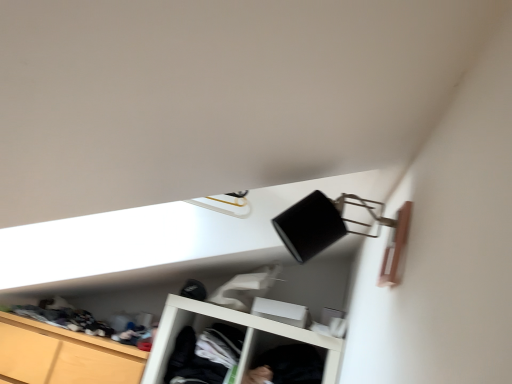
The height and width of the screenshot is (384, 512). What do you see at coordinates (293, 364) in the screenshot?
I see `black cotton shirt at lower center, the first clothing when ordered from right to left` at bounding box center [293, 364].

The height and width of the screenshot is (384, 512). Identify the location of black cotton shirt at lower center, the first clothing when ordered from right to left. (293, 364).

The width and height of the screenshot is (512, 384). What do you see at coordinates (205, 354) in the screenshot?
I see `dark gray fabric at center, the first clothing when ordered from left to right` at bounding box center [205, 354].

You are a GUI agent. You are given a task and a screenshot of the screen. Output one action in this format:
    pyautogui.click(x=<x>, y=<y>)
    Task: Click on the dark gray fabric at center, the second clothing when ordered from right to left
    This screenshot has height=384, width=512.
    Given the screenshot: What is the action you would take?
    pyautogui.click(x=205, y=354)

Locate an element on the screen. The height and width of the screenshot is (384, 512). black cotton shirt at lower center, the second clothing viewed from the left is located at coordinates (293, 364).

This screenshot has width=512, height=384. Find the location of `cabinetry lying on the left of black cotton shirt at lower center, the first clothing when ordered from right to left`. cabinetry lying on the left of black cotton shirt at lower center, the first clothing when ordered from right to left is located at coordinates (63, 355).

Which object is further away from the camera taking this photo, wooden cabinet at lower left or black cotton shirt at lower center, the first clothing when ordered from right to left?

wooden cabinet at lower left is further from the camera.

Consider the image. From a real-world perspective, is wooden cabinet at lower left positioned under black cotton shirt at lower center, the second clothing viewed from the left, based on gravity?

Yes, from a real-world perspective, wooden cabinet at lower left is under black cotton shirt at lower center, the second clothing viewed from the left.

From the image's perspective, count 2nd clothings upward from the wooden cabinet at lower left and point to it. Please provide its 2D coordinates.

[(205, 354)]

Is wooden cabinet at lower left bigger or smaller than dark gray fabric at center, the second clothing when ordered from right to left?

Clearly, wooden cabinet at lower left is larger in size than dark gray fabric at center, the second clothing when ordered from right to left.

From a real-world perspective, is wooden cabinet at lower left beneath dark gray fabric at center, the second clothing when ordered from right to left?

Correct, in the physical world, wooden cabinet at lower left is lower than dark gray fabric at center, the second clothing when ordered from right to left.

From the picture: Is dark gray fabric at center, the second clothing when ordered from right to left, not close to wooden cabinet at lower left?

No, there isn't a large distance between dark gray fabric at center, the second clothing when ordered from right to left, and wooden cabinet at lower left.

From the image's perspective, is dark gray fabric at center, the second clothing when ordered from right to left, positioned above or below wooden cabinet at lower left?

Clearly, from the image's perspective, dark gray fabric at center, the second clothing when ordered from right to left, is above wooden cabinet at lower left.

Considering the sizes of dark gray fabric at center, the second clothing when ordered from right to left, and wooden cabinet at lower left in the image, is dark gray fabric at center, the second clothing when ordered from right to left, bigger or smaller than wooden cabinet at lower left?

Considering their sizes, dark gray fabric at center, the second clothing when ordered from right to left, takes up less space than wooden cabinet at lower left.

Which is behind, dark gray fabric at center, the second clothing when ordered from right to left, or wooden cabinet at lower left?

dark gray fabric at center, the second clothing when ordered from right to left.

Visually, is black cotton shirt at lower center, the second clothing viewed from the left, positioned to the left or to the right of wooden cabinet at lower left?

Clearly, black cotton shirt at lower center, the second clothing viewed from the left, is on the right of wooden cabinet at lower left in the image.

Find the location of a particular element. cabinetry beneath the black cotton shirt at lower center, the first clothing when ordered from right to left (from a real-world perspective) is located at coordinates [63, 355].

Does black cotton shirt at lower center, the second clothing viewed from the left, have a lesser height compared to wooden cabinet at lower left?

Indeed, black cotton shirt at lower center, the second clothing viewed from the left, has a lesser height compared to wooden cabinet at lower left.

From the image's perspective, which is below, dark gray fabric at center, the first clothing when ordered from left to right, or black cotton shirt at lower center, the second clothing viewed from the left?

black cotton shirt at lower center, the second clothing viewed from the left, from the image's perspective.

Is dark gray fabric at center, the first clothing when ordered from left to right, behind black cotton shirt at lower center, the second clothing viewed from the left?

Yes.

From a real-world perspective, is dark gray fabric at center, the second clothing when ordered from right to left, above or below black cotton shirt at lower center, the second clothing viewed from the left?

Clearly, from a real-world perspective, dark gray fabric at center, the second clothing when ordered from right to left, is below black cotton shirt at lower center, the second clothing viewed from the left.

There is a dark gray fabric at center, the first clothing when ordered from left to right. Identify the location of clothing above it (from a real-world perspective). Image resolution: width=512 pixels, height=384 pixels. (293, 364).

The image size is (512, 384). What are the coordinates of `clothing on the left of black cotton shirt at lower center, the second clothing viewed from the left` in the screenshot? It's located at [x=205, y=354].

Between black cotton shirt at lower center, the first clothing when ordered from right to left, and dark gray fabric at center, the first clothing when ordered from left to right, which one has smaller width?

black cotton shirt at lower center, the first clothing when ordered from right to left, is thinner.

Is dark gray fabric at center, the first clothing when ordered from left to right, inside black cotton shirt at lower center, the second clothing viewed from the left?

Actually, dark gray fabric at center, the first clothing when ordered from left to right, is outside black cotton shirt at lower center, the second clothing viewed from the left.

Which clothing is the 2nd one when counting from the right side of the wooden cabinet at lower left? Please provide its 2D coordinates.

[(293, 364)]

Find the location of a particular element. Image resolution: width=512 pixels, height=384 pixels. cabinetry that appears below the dark gray fabric at center, the first clothing when ordered from left to right (from the image's perspective) is located at coordinates (63, 355).

Based on their spatial positions, is dark gray fabric at center, the first clothing when ordered from left to right, or black cotton shirt at lower center, the first clothing when ordered from right to left, closer to wooden cabinet at lower left?

dark gray fabric at center, the first clothing when ordered from left to right, is closer to wooden cabinet at lower left.

Looking at the image, which one is located closer to dark gray fabric at center, the first clothing when ordered from left to right, black cotton shirt at lower center, the second clothing viewed from the left, or wooden cabinet at lower left?

black cotton shirt at lower center, the second clothing viewed from the left, is closer to dark gray fabric at center, the first clothing when ordered from left to right.

Which object lies nearer to the anchor point wooden cabinet at lower left, black cotton shirt at lower center, the first clothing when ordered from right to left, or dark gray fabric at center, the first clothing when ordered from left to right?

The object closer to wooden cabinet at lower left is dark gray fabric at center, the first clothing when ordered from left to right.

Based on their spatial positions, is wooden cabinet at lower left or black cotton shirt at lower center, the first clothing when ordered from right to left, further from dark gray fabric at center, the first clothing when ordered from left to right?

wooden cabinet at lower left.

Based on their spatial positions, is dark gray fabric at center, the second clothing when ordered from right to left, or wooden cabinet at lower left closer to black cotton shirt at lower center, the second clothing viewed from the left?

Among the two, dark gray fabric at center, the second clothing when ordered from right to left, is located nearer to black cotton shirt at lower center, the second clothing viewed from the left.

Considering their positions, is wooden cabinet at lower left positioned closer to black cotton shirt at lower center, the second clothing viewed from the left, than dark gray fabric at center, the first clothing when ordered from left to right?

dark gray fabric at center, the first clothing when ordered from left to right.

You are a GUI agent. You are given a task and a screenshot of the screen. Output one action in this format:
    pyautogui.click(x=<x>, y=<y>)
    Task: Click on the clothing between wooden cabinet at lower left and black cotton shirt at lower center, the second clothing viewed from the left, in the horizontal direction
    The image size is (512, 384).
    Given the screenshot: What is the action you would take?
    pyautogui.click(x=205, y=354)